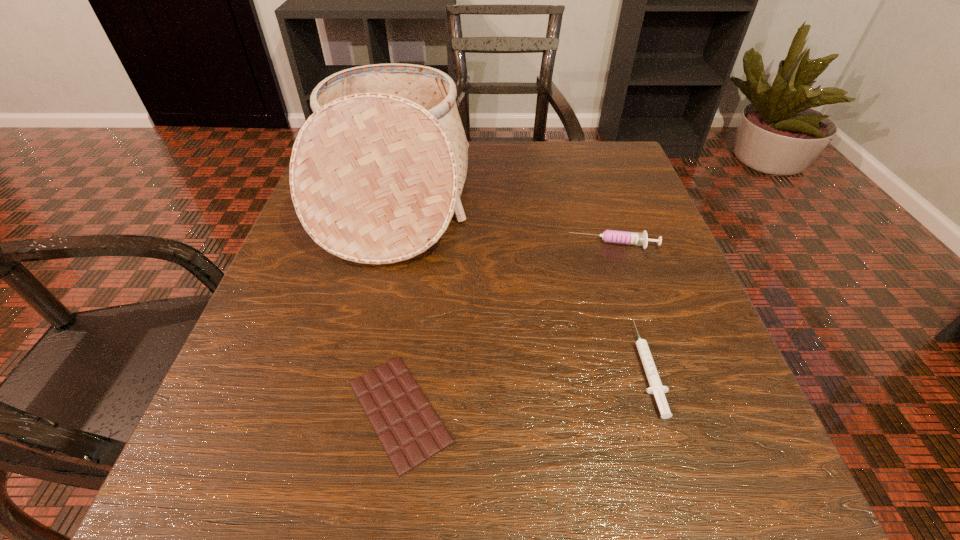
Locate an element on the screen. The image size is (960, 540). basket is located at coordinates (376, 174).

Where is `the second tallest object`? The image size is (960, 540). the second tallest object is located at coordinates click(610, 236).

Find the location of a particular element. Image resolution: width=960 pixels, height=540 pixels. the taller syringe is located at coordinates (610, 236).

Where is `the second shortest object`? the second shortest object is located at coordinates (656, 387).

At what (x,y) coordinates should I click in order to perform the action: click on the shorter syringe. Please return your answer as a coordinate pair (x, y). Looking at the image, I should click on (656, 387).

The image size is (960, 540). Identify the location of the shortest object. (411, 432).

Find the location of a particular element. Image resolution: width=960 pixels, height=540 pixels. free space located 0.290m with the lid open on the tallest object is located at coordinates (605, 197).

This screenshot has width=960, height=540. I want to click on vacant space located 0.180m on the front of the second tallest object, so click(641, 330).

Where is `vacant space situated 0.090m on the front of the shorter syringe`? This screenshot has width=960, height=540. vacant space situated 0.090m on the front of the shorter syringe is located at coordinates (686, 491).

Image resolution: width=960 pixels, height=540 pixels. What are the coordinates of `free space located 0.090m on the left of the shortest object` in the screenshot? It's located at (276, 411).